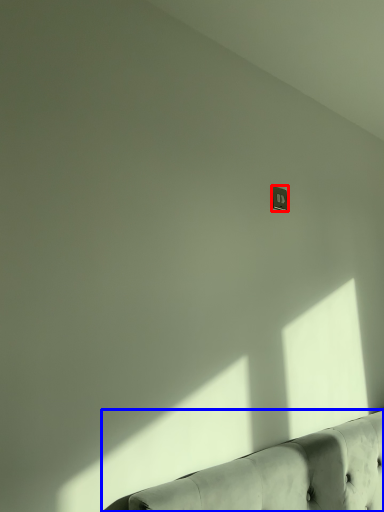
Question: Which object is closer to the camera taking this photo, electric outlet (highlighted by a red box) or studio couch (highlighted by a blue box)?

Choices:
 (A) electric outlet
 (B) studio couch

Answer: (B)